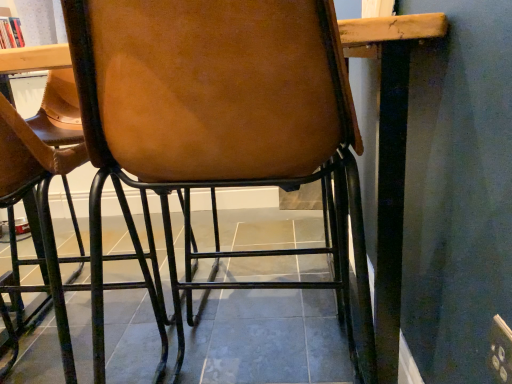
Question: Is white textured curtain at upper left wider or thinner than brown leather chair at center?

Choices:
 (A) wide
 (B) thin

Answer: (B)

Question: From a real-world perspective, relative to brown leather chair at center, is white textured curtain at upper left vertically above or below?

Choices:
 (A) below
 (B) above

Answer: (B)

Question: Is point (40, 44) closer or farther from the camera than point (199, 104)?

Choices:
 (A) closer
 (B) farther

Answer: (B)

Question: Considering the positions of brown leather chair at center and white textured curtain at upper left in the image, is brown leather chair at center bigger or smaller than white textured curtain at upper left?

Choices:
 (A) small
 (B) big

Answer: (B)

Question: Is brown leather chair at center in front of or behind white textured curtain at upper left in the image?

Choices:
 (A) front
 (B) behind

Answer: (A)

Question: In the image, is brown leather chair at center on the left side or the right side of white textured curtain at upper left?

Choices:
 (A) left
 (B) right

Answer: (B)

Question: In terms of height, does brown leather chair at center look taller or shorter compared to white textured curtain at upper left?

Choices:
 (A) short
 (B) tall

Answer: (B)